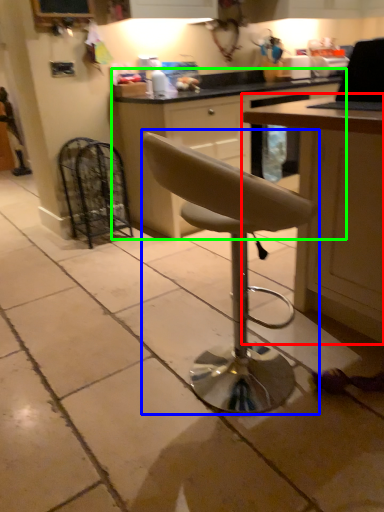
Question: Based on their relative distances, which object is farther from table (highlighted by a red box)? Choose from chair (highlighted by a blue box) and cabinetry (highlighted by a green box).

Choices:
 (A) chair
 (B) cabinetry

Answer: (B)